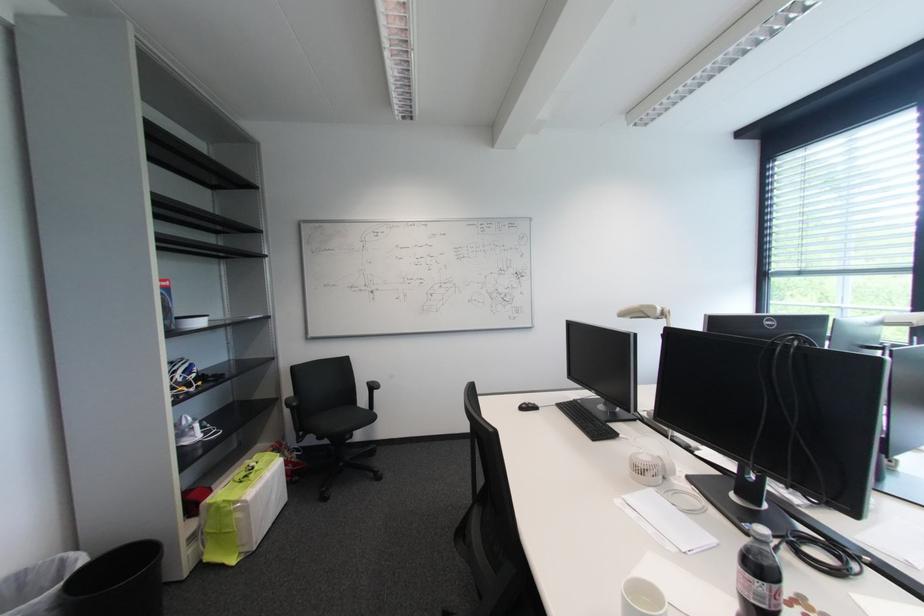
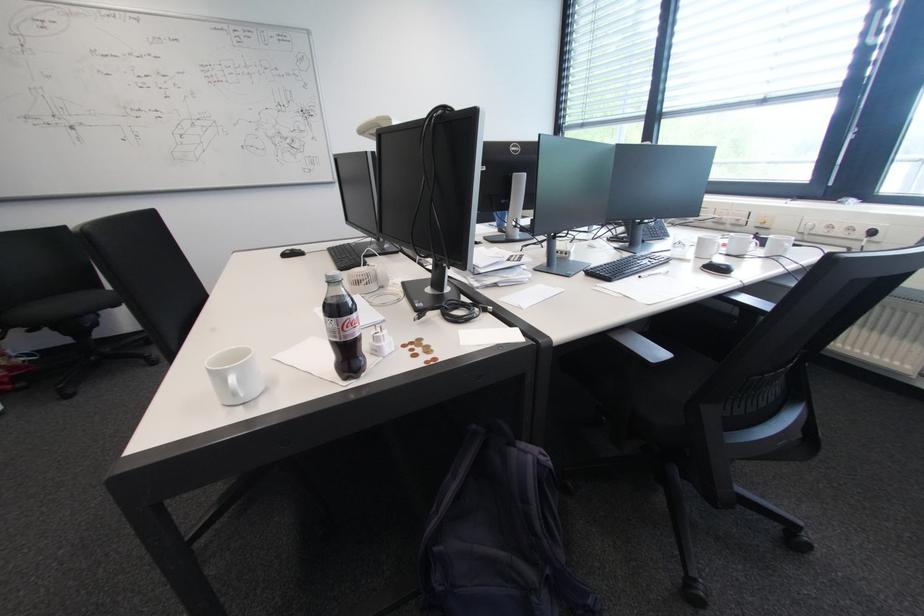
From the picture: The first image is from the beginning of the video and the second image is from the end. How did the camera likely rotate when shooting the video?

The rotation direction of the camera is right-down.